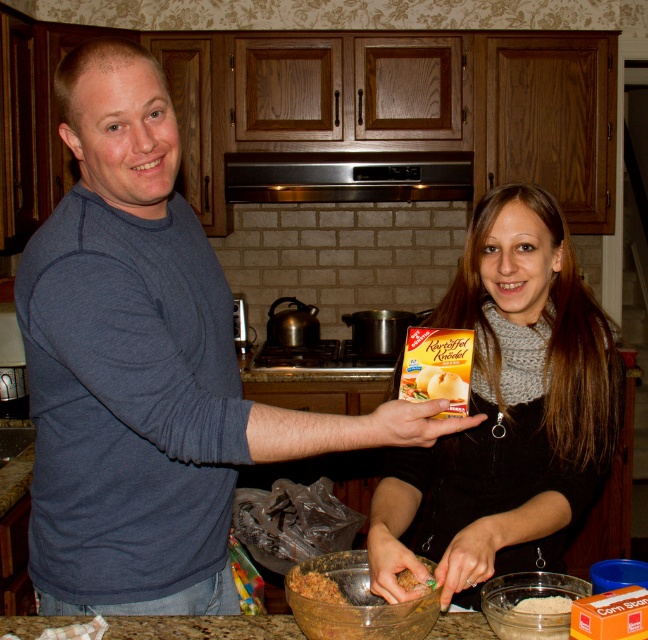
Question: Which of the following is the closest to the observer?

Choices:
 (A) white matte rice at lower right
 (B) satin silver exhaust hood at center
 (C) black knit scarf at center

Answer: (A)

Question: Which point is closer to the camera taking this photo?

Choices:
 (A) (550, 598)
 (B) (211, 369)

Answer: (A)

Question: Does satin silver exhaust hood at center come in front of white matte rice at lower right?

Choices:
 (A) no
 (B) yes

Answer: (A)

Question: Is matte blue sweater at center below white matte rice at lower right?

Choices:
 (A) yes
 (B) no

Answer: (B)

Question: Which point is closer to the camera?

Choices:
 (A) (71, 132)
 (B) (555, 604)

Answer: (A)

Question: Where is black knit scarf at center located in relation to satin silver exhaust hood at center in the image?

Choices:
 (A) right
 (B) left

Answer: (A)